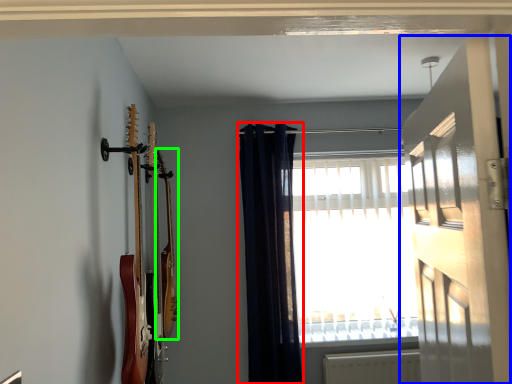
Question: Based on their relative distances, which object is nearer to curtain (highlighted by a red box)? Choose from door (highlighted by a blue box) and guitar (highlighted by a green box).

Choices:
 (A) door
 (B) guitar

Answer: (B)